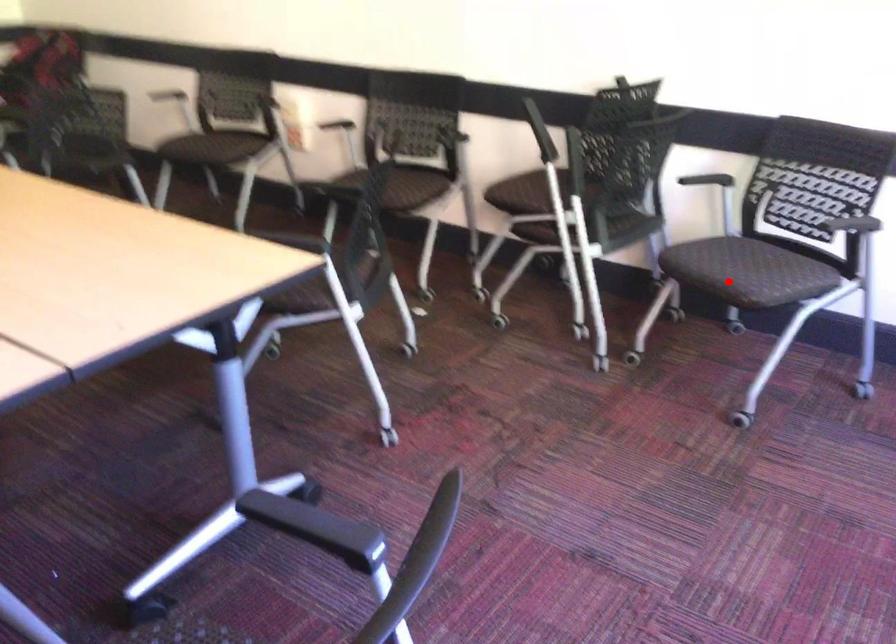
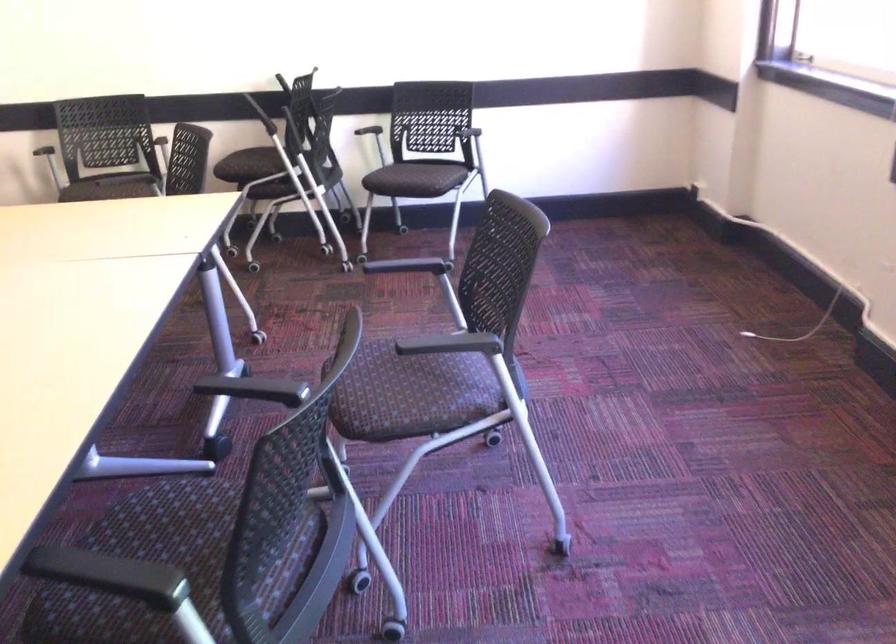
Question: I am providing you with two images of the same scene from different viewpoints. In image1, a red point is highlighted. Considering the same 3D point in image2, which of the following is correct?

Choices:
 (A) It is closer
 (B) It is farther

Answer: (B)